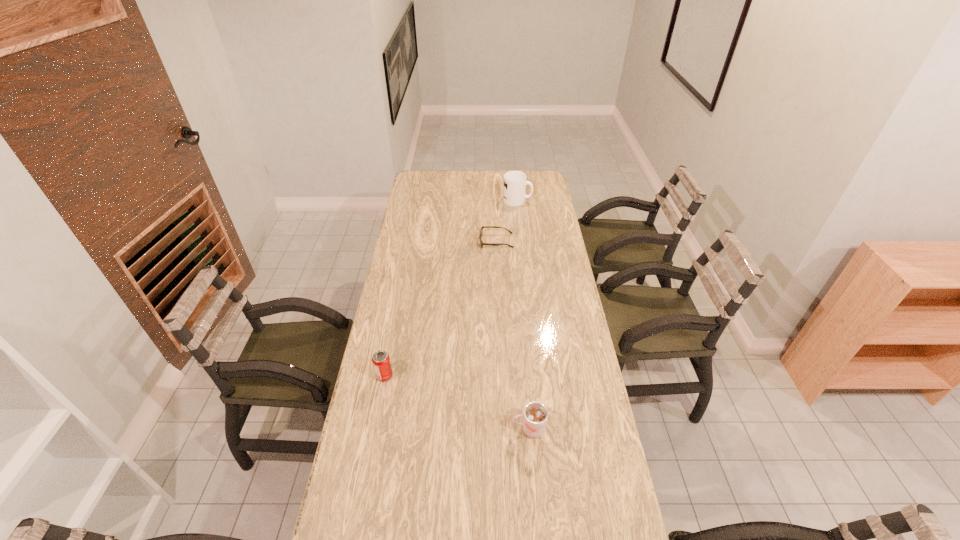
Where is `vacant point located on the side with the handle of the cup`? The image size is (960, 540). vacant point located on the side with the handle of the cup is located at coordinates (420, 429).

Where is `blank space located on the front of the leftmost object`? The width and height of the screenshot is (960, 540). blank space located on the front of the leftmost object is located at coordinates (363, 489).

The width and height of the screenshot is (960, 540). What are the coordinates of `free space located 0.250m on the front-facing side of the sunglasses` in the screenshot? It's located at (426, 241).

Locate an element on the screen. The height and width of the screenshot is (540, 960). free space located on the front-facing side of the sunglasses is located at coordinates (423, 241).

I want to click on vacant space situated 0.170m on the front-facing side of the sunglasses, so click(443, 241).

Identify the location of object at the left edge. The width and height of the screenshot is (960, 540). (381, 362).

Locate an element on the screen. object that is at the right edge is located at coordinates (515, 182).

I want to click on vacant space at the far edge of the desktop, so tap(492, 176).

This screenshot has height=540, width=960. In order to click on free space at the left edge of the desktop in this screenshot , I will do `click(417, 364)`.

You are a GUI agent. You are given a task and a screenshot of the screen. Output one action in this format:
    pyautogui.click(x=<x>, y=<y>)
    Task: Click on the free space at the right edge of the desktop
    This screenshot has width=960, height=540.
    Given the screenshot: What is the action you would take?
    pyautogui.click(x=549, y=199)